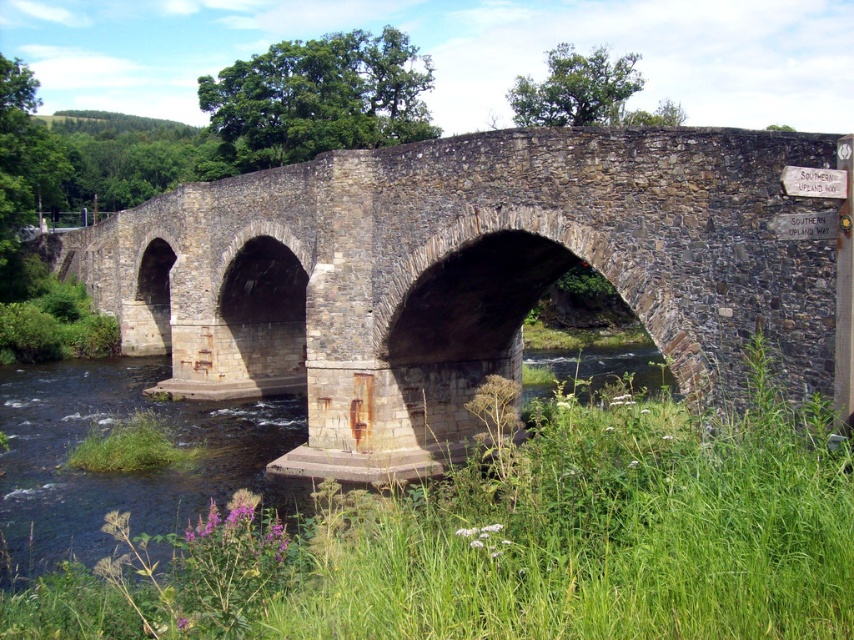
You are standing at the edge of the riverbank and want to cross to the other side using the rusty stone bridge at center. If the bridge is 70.28 feet away from you, and your walking speed is 3 feet per second, how many seconds will it take you to reach the bridge?

The rusty stone bridge at center is 70.28 feet away from the camera. At a walking speed of 3 feet per second, it will take approximately 23.43 seconds to reach the bridge.

You are standing at the point labeled as point (472, 275) on the image. Based on the scene description, what structure are you currently standing on?

The point (472, 275) is on the rusty stone bridge at center, so you are standing on the rusty stone bridge at center.

You are standing on the path leading to the rusty stone bridge at center and want to take a photo of the clear water at bridge lower. Which object should you focus on first to ensure both are in the frame?

You should focus on the rusty stone bridge at center first since it is closer to the viewer than the clear water at bridge lower, ensuring both are in the frame by adjusting the camera angle accordingly.